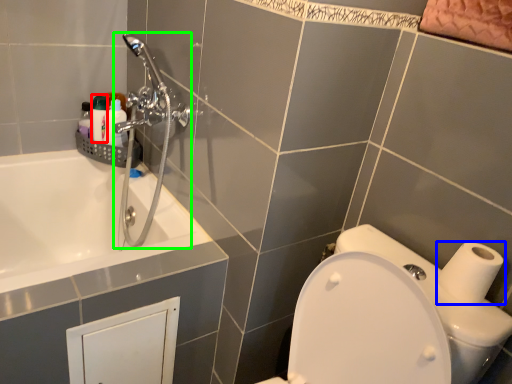
Question: Considering the real-world distances, which object is closest to toiletry (highlighted by a red box)? toilet paper (highlighted by a blue box) or shower (highlighted by a green box).

Choices:
 (A) toilet paper
 (B) shower

Answer: (B)